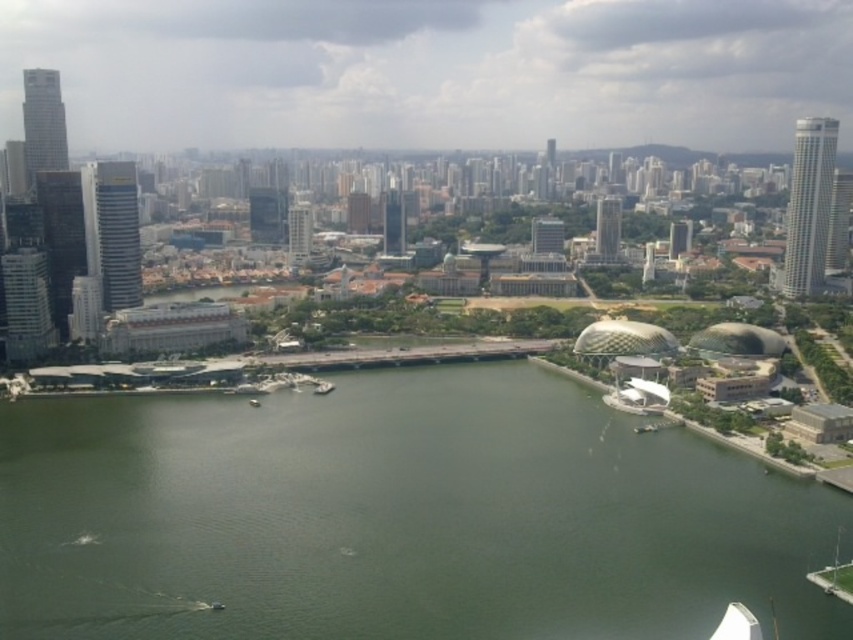
Which is above, green water at center or metallic silver boat at center?

Positioned higher is metallic silver boat at center.

Is green water at center smaller than metallic silver boat at center?

Incorrect, green water at center is not smaller in size than metallic silver boat at center.

Between point (614, 460) and point (323, 390), which one is positioned behind?

Point (323, 390)

At what (x,y) coordinates should I click in order to perform the action: click on green water at center. Please return your answer as a coordinate pair (x, y). The width and height of the screenshot is (853, 640). Looking at the image, I should click on (397, 516).